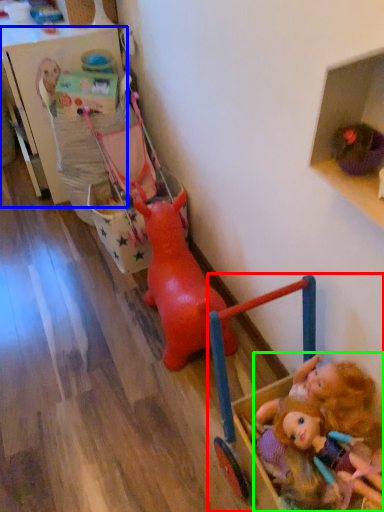
Question: Estimate the real-world distances between objects in this image. Which object is closer to toy (highlighted by a red box), shelf (highlighted by a blue box) or person (highlighted by a green box)?

Choices:
 (A) shelf
 (B) person

Answer: (B)